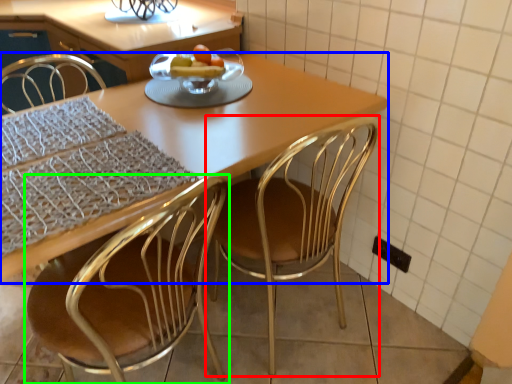
Question: Which object is the farthest from chair (highlighted by a red box)? Choose among these: kitchen & dining room table (highlighted by a blue box) or chair (highlighted by a green box).

Choices:
 (A) kitchen & dining room table
 (B) chair

Answer: (B)